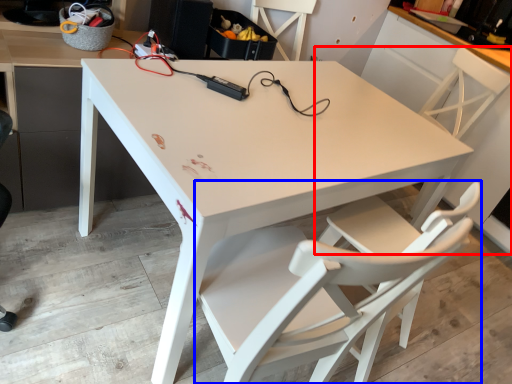
Question: Which object appears closest to the camera in this image, chair (highlighted by a red box) or chair (highlighted by a blue box)?

Choices:
 (A) chair
 (B) chair

Answer: (B)